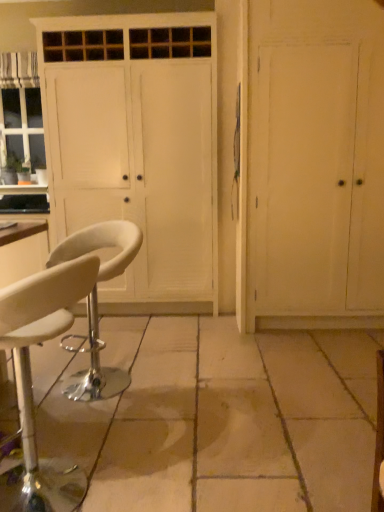
Where is `vacant area to the right of white leather stool at lower left, the second chair from the front`? The width and height of the screenshot is (384, 512). vacant area to the right of white leather stool at lower left, the second chair from the front is located at coordinates (182, 381).